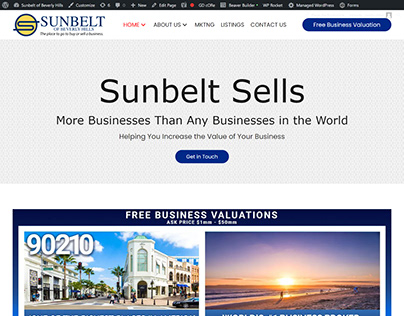
Image resolution: width=404 pixels, height=316 pixels. In order to click on rectangular photographs of tourist destination in this screenshot , I will do (x=142, y=267), (x=280, y=269).